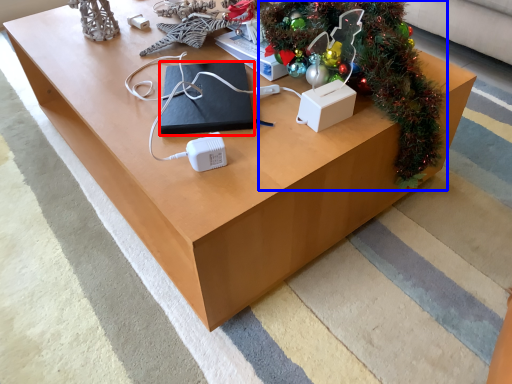
Question: Among these objects, which one is nearest to the camera, pad (highlighted by a red box) or christmas tree (highlighted by a blue box)?

Choices:
 (A) pad
 (B) christmas tree

Answer: (B)